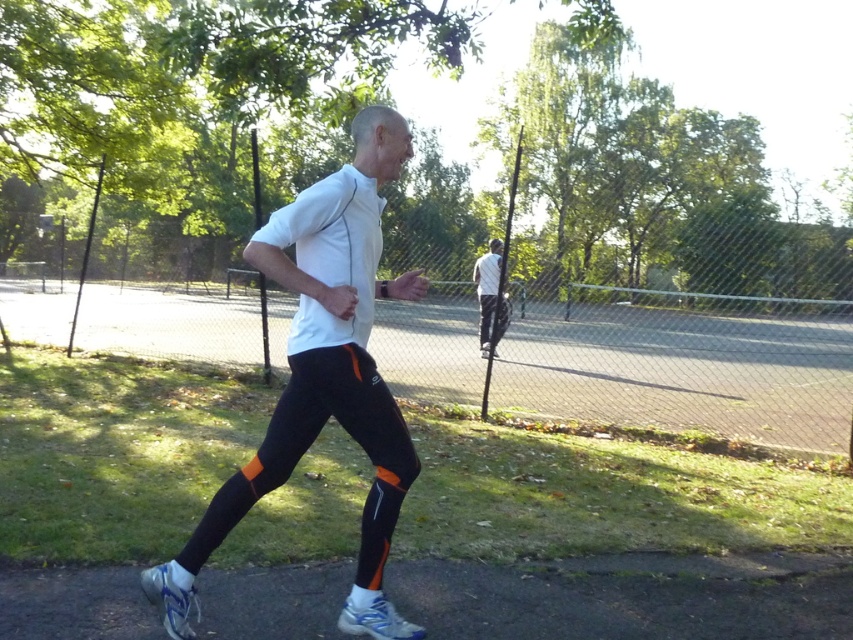
You are a photographer trying to capture the jogger in the scene. You notice the white matte running pants at center and the white mesh running shoe at lower left. Which of these items would appear bigger in your photo?

The white matte running pants at center would appear bigger in the photo because it has a larger size compared to the white mesh running shoe at lower left.

You are a photographer standing at the starting point of the jogging path. You want to take a closeup photo of the white matte running pants at center without moving. Can you do it with a standard camera lens that has a maximum focal length of 50mm?

The white matte running pants at center and viewer are 1.88 meters apart. With a standard 50mm lens, this distance is manageable for a closeup, so yes, you can take the photo without moving.

You are a photographer standing at the center of the path in the scene. You want to capture a photo of the white mesh running shoe at lower left. Based on its 2D location, where should you position your camera relative to the shoe?

The white mesh running shoe at lower left is located at point 0.939 on the x axis and 0.200 on the y axis. To capture it in the photo, position your camera to the right and slightly above the shoe since higher x values are on the right and higher y values are upwards in the image coordinate system.